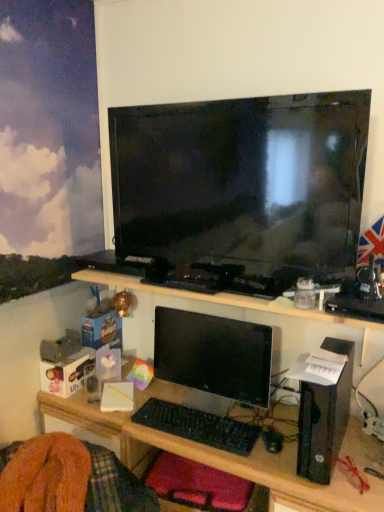
What is the approximate height of black glossy tv at upper center?

The height of black glossy tv at upper center is 24.16 inches.

At what (x,y) coordinates should I click in order to perform the action: click on black glossy tv at upper center. Please return your answer as a coordinate pair (x, y). This screenshot has height=512, width=384. Looking at the image, I should click on (242, 182).

Locate an element on the screen. black plastic mouse at lower center is located at coordinates (272, 440).

This screenshot has height=512, width=384. In order to click on black glossy monitor at center in this screenshot , I will do `click(214, 354)`.

I want to click on black plastic computer at right, so click(x=324, y=418).

At what (x,y) coordinates should I click in order to perform the action: click on black plastic monitor at center. Please return your answer as a coordinate pair (x, y). Looking at the image, I should click on (236, 457).

Is black plastic keyboard at center at the right side of black glossy monitor at center?

No.

How many degrees apart are the facing directions of black plastic keyboard at center and black glossy monitor at center?

The angle between the facing direction of black plastic keyboard at center and the facing direction of black glossy monitor at center is 0.98 degrees.

Is black plastic keyboard at center spatially inside black glossy monitor at center, or outside of it?

black plastic keyboard at center lies outside black glossy monitor at center.

Is black plastic keyboard at center beside black glossy monitor at center?

There is a gap between black plastic keyboard at center and black glossy monitor at center.

Between velvet-like red cushion at lower center and black plastic mouse at lower center, which one has smaller size?

black plastic mouse at lower center is smaller.

Which object is positioned more to the left, velvet-like red cushion at lower center or black plastic mouse at lower center?

From the viewer's perspective, velvet-like red cushion at lower center appears more on the left side.

Locate an element on the screen. The image size is (384, 512). mouse above the velvet-like red cushion at lower center (from a real-world perspective) is located at coordinates (272, 440).

Is velvet-like red cushion at lower center aimed at black plastic mouse at lower center?

No.

Measure the distance from black plastic keyboard at center to black plastic mouse at lower center.

black plastic keyboard at center is 8.50 inches away from black plastic mouse at lower center.

Is black plastic keyboard at center not close to black plastic mouse at lower center?

black plastic keyboard at center is actually quite close to black plastic mouse at lower center.

Considering the positions of point (181, 428) and point (274, 442), is point (181, 428) closer or farther from the camera than point (274, 442)?

Point (181, 428) is positioned farther from the camera compared to point (274, 442).

From the image's perspective, which one is positioned lower, black plastic keyboard at center or black plastic mouse at lower center?

black plastic mouse at lower center, from the image's perspective.

Is black plastic mouse at lower center not near black glossy monitor at center?

They are positioned close to each other.

Measure the distance between black plastic mouse at lower center and black glossy monitor at center.

14.07 inches.

Identify the location of mouse to the right of black glossy monitor at center. (272, 440).

Is black plastic mouse at lower center in front of black glossy monitor at center?

Yes, black plastic mouse at lower center is closer to the viewer.

Which of these two, black plastic mouse at lower center or black plastic monitor at center, is wider?

black plastic monitor at center is wider.

Is black plastic monitor at center a part of black plastic mouse at lower center?

No, black plastic monitor at center is located outside of black plastic mouse at lower center.

From a real-world perspective, which is physically above, black plastic mouse at lower center or black plastic monitor at center?

black plastic mouse at lower center.

Is black plastic monitor at center smaller than velvet-like red cushion at lower center?

No, black plastic monitor at center is not smaller than velvet-like red cushion at lower center.

Is black plastic monitor at center oriented towards velvet-like red cushion at lower center?

Yes, black plastic monitor at center faces towards velvet-like red cushion at lower center.

Who is taller, black plastic monitor at center or velvet-like red cushion at lower center?

black plastic monitor at center.

From a real-world perspective, between black glossy tv at upper center and black plastic mouse at lower center, who is vertically lower?

black plastic mouse at lower center is physically lower.

Which of these two, black glossy tv at upper center or black plastic mouse at lower center, stands taller?

With more height is black glossy tv at upper center.

Do you think black glossy tv at upper center is within black plastic mouse at lower center, or outside of it?

black glossy tv at upper center exists outside the volume of black plastic mouse at lower center.

Which is more to the right, black glossy tv at upper center or black plastic mouse at lower center?

black plastic mouse at lower center is more to the right.

Locate an element on the screen. Image resolution: width=384 pixels, height=512 pixels. computer keyboard below the black glossy monitor at center (from a real-world perspective) is located at coordinates (198, 426).

Where is `mouse behind the velvet-like red cushion at lower center`? The image size is (384, 512). mouse behind the velvet-like red cushion at lower center is located at coordinates (272, 440).

From the picture: Considering their positions, is black plastic mouse at lower center positioned further to black plastic monitor at center than black glossy tv at upper center?

Among the two, black glossy tv at upper center is located further to black plastic monitor at center.

From the image, which object appears to be farther from black glossy monitor at center, black plastic monitor at center or black glossy tv at upper center?

black glossy tv at upper center.

Based on their spatial positions, is velvet-like red cushion at lower center or black plastic mouse at lower center further from black plastic keyboard at center?

black plastic mouse at lower center lies further to black plastic keyboard at center than the other object.

Looking at the image, which one is located further to black glossy monitor at center, black plastic mouse at lower center or black glossy tv at upper center?

black glossy tv at upper center lies further to black glossy monitor at center than the other object.

Based on their spatial positions, is velvet-like red cushion at lower center or black plastic monitor at center closer to black plastic keyboard at center?

The object closer to black plastic keyboard at center is black plastic monitor at center.

Based on their spatial positions, is velvet-like red cushion at lower center or black plastic mouse at lower center further from black glossy monitor at center?

velvet-like red cushion at lower center is further to black glossy monitor at center.

Which object lies further to the anchor point black plastic mouse at lower center, velvet-like red cushion at lower center or black plastic monitor at center?

Among the two, black plastic monitor at center is located further to black plastic mouse at lower center.

Which object lies further to the anchor point black plastic monitor at center, velvet-like red cushion at lower center or black plastic computer at right?

black plastic computer at right lies further to black plastic monitor at center than the other object.

I want to click on computer between black glossy tv at upper center and black plastic keyboard at center in the vertical direction, so click(x=324, y=418).

Where is `desk that lies between black plastic computer at right and velvet-like red cushion at lower center from top to bottom`? This screenshot has height=512, width=384. desk that lies between black plastic computer at right and velvet-like red cushion at lower center from top to bottom is located at coordinates (236, 457).

Where is `mouse between black plastic keyboard at center and black plastic computer at right`? The width and height of the screenshot is (384, 512). mouse between black plastic keyboard at center and black plastic computer at right is located at coordinates (272, 440).

At what (x,y) coordinates should I click in order to perform the action: click on computer monitor between black plastic keyboard at center and black plastic mouse at lower center from left to right. Please return your answer as a coordinate pair (x, y). The image size is (384, 512). Looking at the image, I should click on (214, 354).